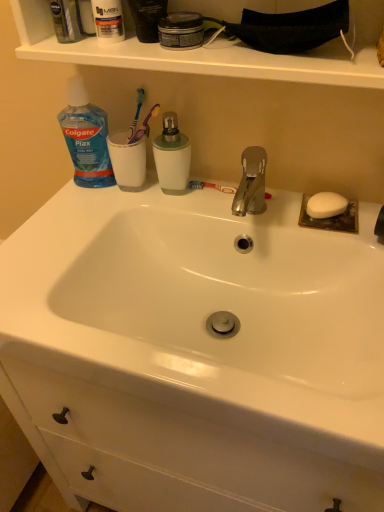
This screenshot has width=384, height=512. Describe the element at coordinates (86, 137) in the screenshot. I see `blue translucent plastic bottle at upper left` at that location.

I want to click on clear plastic mouthwash at upper left, which is the first mouthwash in left-to-right order, so coord(64,19).

The width and height of the screenshot is (384, 512). Identify the location of green matte mouthwash at center, positioned as the 2th mouthwash in top-to-bottom order. (172, 155).

Locate an element on the screen. blue translucent plastic bottle at upper left is located at coordinates (86, 137).

Consider the image. From a real-world perspective, which is physically above, white glossy sink at center or blue translucent plastic bottle at upper left?

blue translucent plastic bottle at upper left.

Where is `sink beneath the blue translucent plastic bottle at upper left (from a real-world perspective)`? The width and height of the screenshot is (384, 512). sink beneath the blue translucent plastic bottle at upper left (from a real-world perspective) is located at coordinates (231, 292).

Is white glossy sink at center oriented towards blue translucent plastic bottle at upper left?

No.

Is point (277, 330) closer or farther from the camera than point (71, 132)?

Clearly, point (277, 330) is closer to the camera than point (71, 132).

In terms of size, does white matte soap at right appear bigger or smaller than clear plastic mouthwash at upper left, which is counted as the second mouthwash, starting from the right?

white matte soap at right is smaller than clear plastic mouthwash at upper left, which is counted as the second mouthwash, starting from the right.

Is white matte soap at right directly adjacent to clear plastic mouthwash at upper left, the second mouthwash from the bottom?

There is a gap between white matte soap at right and clear plastic mouthwash at upper left, the second mouthwash from the bottom.

Do you think white matte soap at right is within clear plastic mouthwash at upper left, which is the first mouthwash in left-to-right order, or outside of it?

white matte soap at right is outside clear plastic mouthwash at upper left, which is the first mouthwash in left-to-right order.

From a real-world perspective, which is physically above, white matte soap at right or clear plastic mouthwash at upper left, which is counted as the second mouthwash, starting from the right?

clear plastic mouthwash at upper left, which is counted as the second mouthwash, starting from the right, is physically above.

Considering the sizes of clear plastic mouthwash at upper left, acting as the 1th mouthwash starting from the top, and green matte mouthwash at center, positioned as the 2th mouthwash in top-to-bottom order, in the image, is clear plastic mouthwash at upper left, acting as the 1th mouthwash starting from the top, bigger or smaller than green matte mouthwash at center, positioned as the 2th mouthwash in top-to-bottom order,?

clear plastic mouthwash at upper left, acting as the 1th mouthwash starting from the top, is smaller than green matte mouthwash at center, positioned as the 2th mouthwash in top-to-bottom order.

Is clear plastic mouthwash at upper left, the second mouthwash from the bottom, wider or thinner than green matte mouthwash at center, marked as the 1th mouthwash in a right-to-left arrangement?

Clearly, clear plastic mouthwash at upper left, the second mouthwash from the bottom, has less width compared to green matte mouthwash at center, marked as the 1th mouthwash in a right-to-left arrangement.

Is clear plastic mouthwash at upper left, which is the first mouthwash in left-to-right order, beside green matte mouthwash at center, positioned as the 2th mouthwash in top-to-bottom order?

No, clear plastic mouthwash at upper left, which is the first mouthwash in left-to-right order, is not with green matte mouthwash at center, positioned as the 2th mouthwash in top-to-bottom order.

Considering the points (142, 88) and (59, 36), which point is in front, point (142, 88) or point (59, 36)?

The point (59, 36) is closer.

Is blue plastic toothbrush at upper center outside of clear plastic mouthwash at upper left, acting as the 1th mouthwash starting from the top?

Yes, blue plastic toothbrush at upper center is located beyond the bounds of clear plastic mouthwash at upper left, acting as the 1th mouthwash starting from the top.

Looking at their sizes, would you say blue plastic toothbrush at upper center is wider or thinner than clear plastic mouthwash at upper left, which is the first mouthwash in left-to-right order?

Considering their sizes, blue plastic toothbrush at upper center looks slimmer than clear plastic mouthwash at upper left, which is the first mouthwash in left-to-right order.

Is the depth of blue plastic toothbrush at upper center less than that of clear plastic mouthwash at upper left, which is counted as the second mouthwash, starting from the right?

No, blue plastic toothbrush at upper center is further to the viewer.

How much distance is there between green matte mouthwash at center, positioned as the 2th mouthwash in top-to-bottom order, and blue translucent plastic bottle at upper left?

green matte mouthwash at center, positioned as the 2th mouthwash in top-to-bottom order, and blue translucent plastic bottle at upper left are 5.71 inches apart from each other.

Does green matte mouthwash at center, positioned as the 2th mouthwash in top-to-bottom order, have a smaller size compared to blue translucent plastic bottle at upper left?

Correct, green matte mouthwash at center, positioned as the 2th mouthwash in top-to-bottom order, occupies less space than blue translucent plastic bottle at upper left.

Which of these two, green matte mouthwash at center, the first mouthwash in the bottom-to-top sequence, or blue translucent plastic bottle at upper left, stands shorter?

green matte mouthwash at center, the first mouthwash in the bottom-to-top sequence, is shorter.

Can you confirm if green matte mouthwash at center, which appears as the second mouthwash when viewed from the left, is positioned to the left of blue translucent plastic bottle at upper left?

No, green matte mouthwash at center, which appears as the second mouthwash when viewed from the left, is not to the left of blue translucent plastic bottle at upper left.

Looking at their sizes, would you say green matte mouthwash at center, the first mouthwash in the bottom-to-top sequence, is wider or thinner than white glossy sink at center?

In the image, green matte mouthwash at center, the first mouthwash in the bottom-to-top sequence, appears to be more narrow than white glossy sink at center.

Would you consider green matte mouthwash at center, the first mouthwash in the bottom-to-top sequence, to be distant from white glossy sink at center?

green matte mouthwash at center, the first mouthwash in the bottom-to-top sequence, is near white glossy sink at center, not far away.

Find the location of `sink below the green matte mouthwash at center, the first mouthwash in the bottom-to-top sequence (from the image's perspective)`. sink below the green matte mouthwash at center, the first mouthwash in the bottom-to-top sequence (from the image's perspective) is located at coordinates [231, 292].

How many degrees apart are the facing directions of green matte mouthwash at center, the first mouthwash in the bottom-to-top sequence, and white glossy sink at center?

The facing directions of green matte mouthwash at center, the first mouthwash in the bottom-to-top sequence, and white glossy sink at center are 1.79 degrees apart.

Is clear plastic mouthwash at upper left, which is counted as the second mouthwash, starting from the right, positioned with its back to white glossy sink at center?

That's not correct — clear plastic mouthwash at upper left, which is counted as the second mouthwash, starting from the right, is not looking away from white glossy sink at center.

Consider the image. From a real-world perspective, is clear plastic mouthwash at upper left, which is the first mouthwash in left-to-right order, above or below white glossy sink at center?

clear plastic mouthwash at upper left, which is the first mouthwash in left-to-right order, is situated higher than white glossy sink at center in the real world.

Which is nearer, (x=57, y=19) or (x=82, y=267)?

Point (x=57, y=19) is closer to the camera than point (x=82, y=267).

I want to click on cleaning product located above the white glossy sink at center (from a real-world perspective), so click(86, 137).

The width and height of the screenshot is (384, 512). I want to click on soap below the clear plastic mouthwash at upper left, which is the first mouthwash in left-to-right order (from a real-world perspective), so click(x=326, y=205).

From the image, which object appears to be nearer to blue translucent plastic bottle at upper left, clear plastic mouthwash at upper left, which is counted as the second mouthwash, starting from the right, or green matte mouthwash at center, which appears as the second mouthwash when viewed from the left?

green matte mouthwash at center, which appears as the second mouthwash when viewed from the left, is positioned closer to the anchor blue translucent plastic bottle at upper left.

Looking at this image, looking at the image, which one is located further to clear plastic mouthwash at upper left, which is the first mouthwash in left-to-right order, white glossy sink at center or white matte soap at right?

The object further to clear plastic mouthwash at upper left, which is the first mouthwash in left-to-right order, is white matte soap at right.

Estimate the real-world distances between objects in this image. Which object is closer to white matte soap at right, white glossy sink at center or clear plastic mouthwash at upper left, which is the first mouthwash in left-to-right order?

white glossy sink at center.

When comparing their distances from white glossy sink at center, does blue translucent plastic bottle at upper left or clear plastic mouthwash at upper left, the second mouthwash from the bottom, seem further?

clear plastic mouthwash at upper left, the second mouthwash from the bottom, is positioned further to the anchor white glossy sink at center.

Looking at the image, which one is located further to blue plastic toothbrush at upper center, clear plastic mouthwash at upper left, acting as the 1th mouthwash starting from the top, or blue translucent plastic bottle at upper left?

Among the two, clear plastic mouthwash at upper left, acting as the 1th mouthwash starting from the top, is located further to blue plastic toothbrush at upper center.

Which object lies nearer to the anchor point green matte mouthwash at center, which appears as the second mouthwash when viewed from the left, blue translucent plastic bottle at upper left or clear plastic mouthwash at upper left, acting as the 1th mouthwash starting from the top?

blue translucent plastic bottle at upper left is positioned closer to the anchor green matte mouthwash at center, which appears as the second mouthwash when viewed from the left.

When comparing their distances from green matte mouthwash at center, positioned as the 2th mouthwash in top-to-bottom order, does white matte soap at right or blue translucent plastic bottle at upper left seem closer?

blue translucent plastic bottle at upper left lies closer to green matte mouthwash at center, positioned as the 2th mouthwash in top-to-bottom order, than the other object.

Considering their positions, is clear plastic mouthwash at upper left, which is counted as the second mouthwash, starting from the right, positioned further to blue translucent plastic bottle at upper left than white matte soap at right?

white matte soap at right is positioned further to the anchor blue translucent plastic bottle at upper left.

I want to click on mouthwash between blue plastic toothbrush at upper center and white matte soap at right in the horizontal direction, so 172,155.

The height and width of the screenshot is (512, 384). In order to click on toothbrush between clear plastic mouthwash at upper left, the second mouthwash from the bottom, and white matte soap at right from left to right in this screenshot , I will do `click(136, 114)`.

Where is `toothbrush between clear plastic mouthwash at upper left, which is the first mouthwash in left-to-right order, and blue translucent plastic bottle at upper left vertically`? Image resolution: width=384 pixels, height=512 pixels. toothbrush between clear plastic mouthwash at upper left, which is the first mouthwash in left-to-right order, and blue translucent plastic bottle at upper left vertically is located at coordinates (136, 114).

Where is `mouthwash between blue translucent plastic bottle at upper left and white glossy sink at center from top to bottom`? This screenshot has width=384, height=512. mouthwash between blue translucent plastic bottle at upper left and white glossy sink at center from top to bottom is located at coordinates (172, 155).